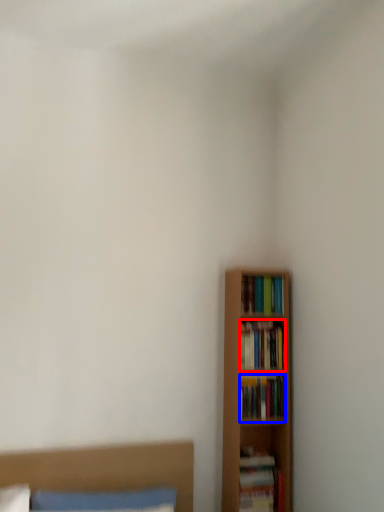
Question: Which object appears farthest to the camera in this image, book (highlighted by a red box) or book (highlighted by a blue box)?

Choices:
 (A) book
 (B) book

Answer: (A)